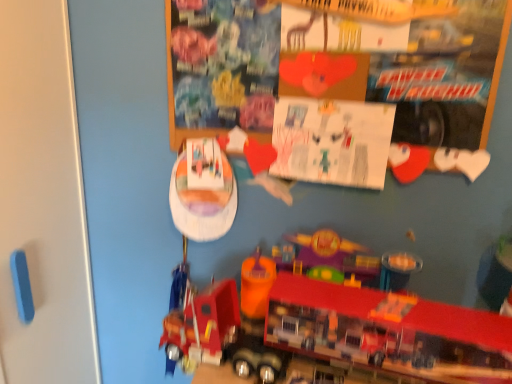
Question: Considering the relative positions of wooden bulletin board at upper center and metallic red truck at lower center in the image provided, is wooden bulletin board at upper center in front of metallic red truck at lower center?

Choices:
 (A) yes
 (B) no

Answer: (B)

Question: Is wooden bulletin board at upper center smaller than metallic red truck at lower center?

Choices:
 (A) yes
 (B) no

Answer: (A)

Question: Can you confirm if wooden bulletin board at upper center is bigger than metallic red truck at lower center?

Choices:
 (A) yes
 (B) no

Answer: (B)

Question: Would you consider wooden bulletin board at upper center to be distant from metallic red truck at lower center?

Choices:
 (A) yes
 (B) no

Answer: (B)

Question: Considering the relative sizes of wooden bulletin board at upper center and metallic red truck at lower center in the image provided, is wooden bulletin board at upper center thinner than metallic red truck at lower center?

Choices:
 (A) yes
 (B) no

Answer: (A)

Question: Looking at their shapes, would you say metallic red truck at lower center is wider or thinner than white paper at upper center?

Choices:
 (A) wide
 (B) thin

Answer: (A)

Question: From a real-world perspective, is metallic red truck at lower center physically located above or below white paper at upper center?

Choices:
 (A) above
 (B) below

Answer: (B)

Question: Is metallic red truck at lower center inside the boundaries of white paper at upper center, or outside?

Choices:
 (A) inside
 (B) outside

Answer: (B)

Question: Is metallic red truck at lower center bigger or smaller than white paper at upper center?

Choices:
 (A) small
 (B) big

Answer: (B)

Question: Would you say wooden bulletin board at upper center is inside or outside white paper at upper center?

Choices:
 (A) outside
 (B) inside

Answer: (A)

Question: Is wooden bulletin board at upper center bigger or smaller than white paper at upper center?

Choices:
 (A) big
 (B) small

Answer: (A)

Question: From their relative heights in the image, would you say wooden bulletin board at upper center is taller or shorter than white paper at upper center?

Choices:
 (A) short
 (B) tall

Answer: (B)

Question: From the image's perspective, is wooden bulletin board at upper center positioned above or below white paper at upper center?

Choices:
 (A) below
 (B) above

Answer: (B)

Question: Would you say wooden bulletin board at upper center is inside or outside metallic red truck at lower center?

Choices:
 (A) outside
 (B) inside

Answer: (A)

Question: Is wooden bulletin board at upper center in front of or behind metallic red truck at lower center in the image?

Choices:
 (A) behind
 (B) front

Answer: (A)